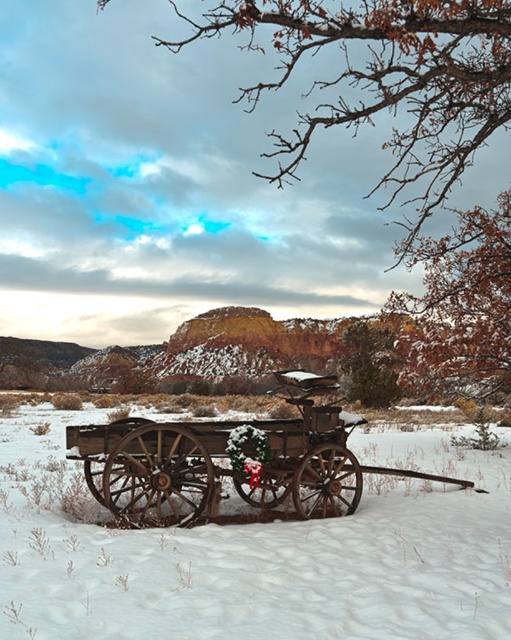
You are standing at the origin point of the coordinate system. You want to move towards the wooden wagon at center. What direction should you move in?

Since the wooden wagon at center is located at coordinate point [258,554], you should move in the positive x and positive y direction to reach it.

You are an observer standing in the snowy field looking at the scene. You see the wooden wagon at center and the rustic wood cart at center. Which object is positioned higher in the image?

The wooden wagon at center is positioned higher than the rustic wood cart at center in the image.